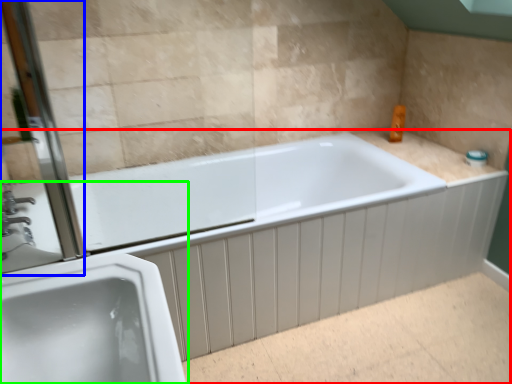
Question: Estimate the real-world distances between objects in this image. Which object is farther from bathtub (highlighted by a red box), screen door (highlighted by a blue box) or sink (highlighted by a green box)?

Choices:
 (A) screen door
 (B) sink

Answer: (A)